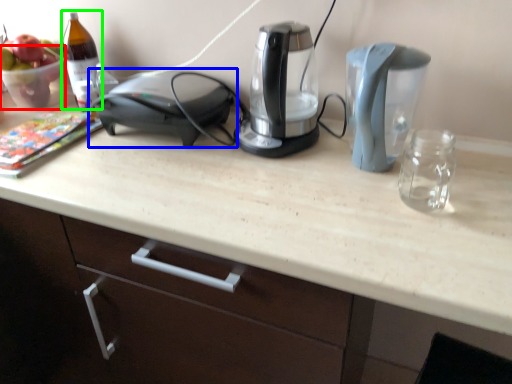
Question: Considering the real-world distances, which object is farthest from glass bowl (highlighted by a red box)? home appliance (highlighted by a blue box) or wine bottle (highlighted by a green box)?

Choices:
 (A) home appliance
 (B) wine bottle

Answer: (A)